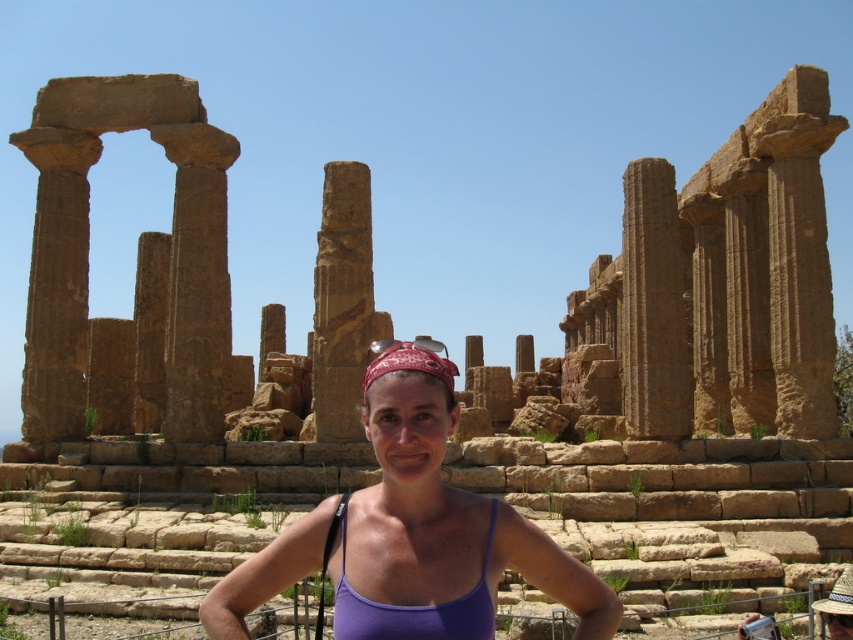
You are a photographer trying to capture the brown stone column at center and the red bandana at center in the same frame. Which object is closer to the camera?

The brown stone column at center is closer to the camera than the red bandana at center, so it will appear in front of the bandana in the photo.

You are a photographer planning to take a photo of the brown stone column at center and the purple fabric at center. Based on the scene description, which object should you focus on first if you want to capture both in sharp focus?

The brown stone column at center is above the purple fabric at center, so you should focus on the brown stone column at center first to ensure both are in sharp focus.